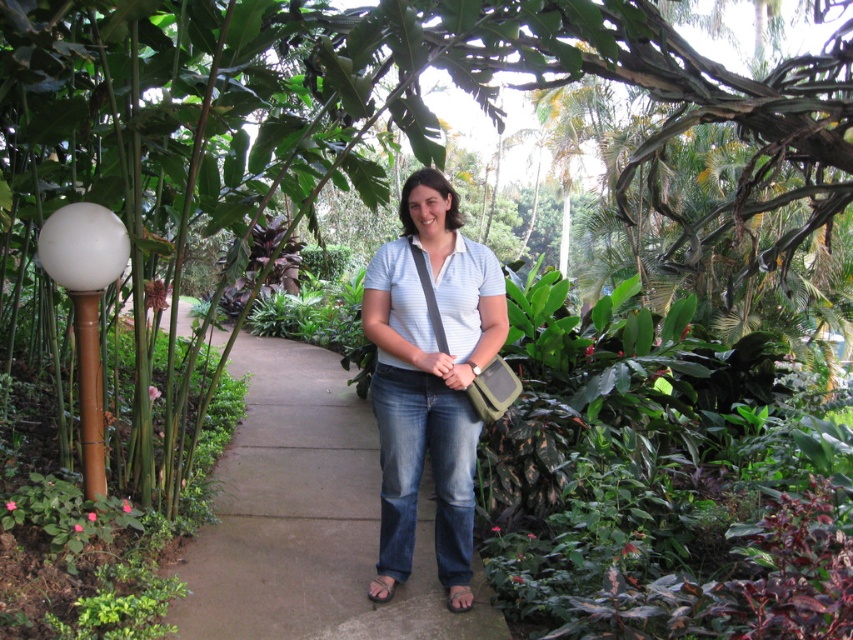
Who is more forward, (305, 362) or (467, 253)?

Point (467, 253)

Describe the element at coordinates (308, 518) in the screenshot. I see `gray concrete pavement at center` at that location.

The image size is (853, 640). I want to click on gray concrete pavement at center, so click(308, 518).